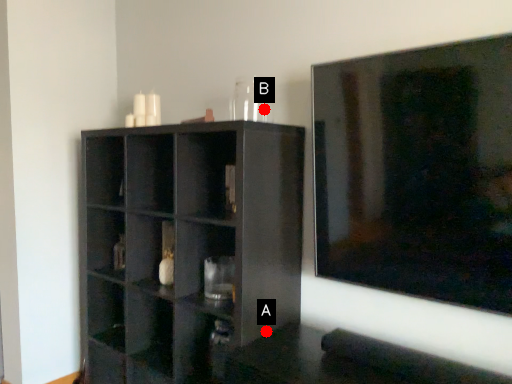
Question: Two points are circled on the image, labeled by A and B beside each circle. Which point appears farthest from the camera in this image?

Choices:
 (A) A is further
 (B) B is further

Answer: (B)